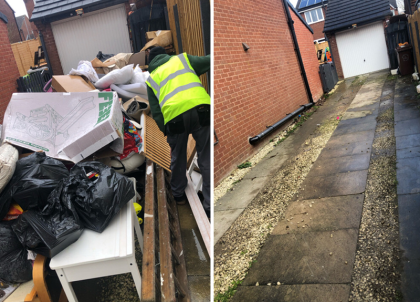
At what (x,y) coordinates should I click in order to perform the action: click on top of white table. Please return your answer as a coordinate pair (x, y). This screenshot has width=420, height=302. Looking at the image, I should click on (110, 244).